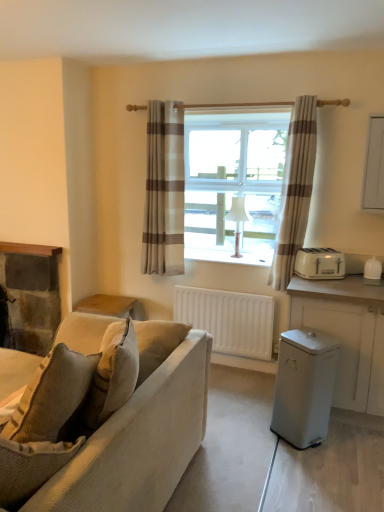
Identify the location of blank space situated above dark stone fireplace at left (from a real-world perspective). This screenshot has height=512, width=384. (19, 253).